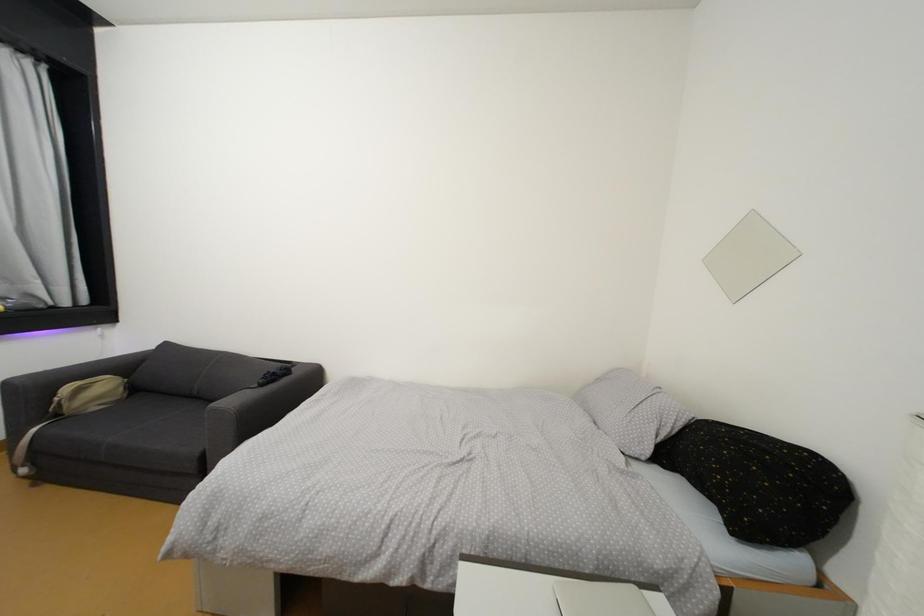
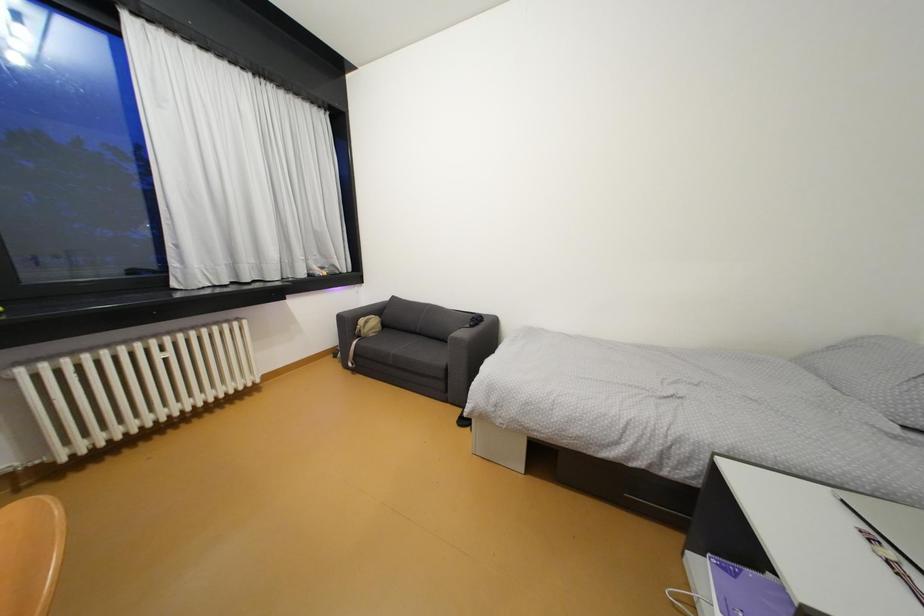
Question: The images are taken continuously from a first-person perspective. In which direction is your viewpoint rotating?

Choices:
 (A) Left
 (B) Right
 (C) Up
 (D) Down

Answer: (A)